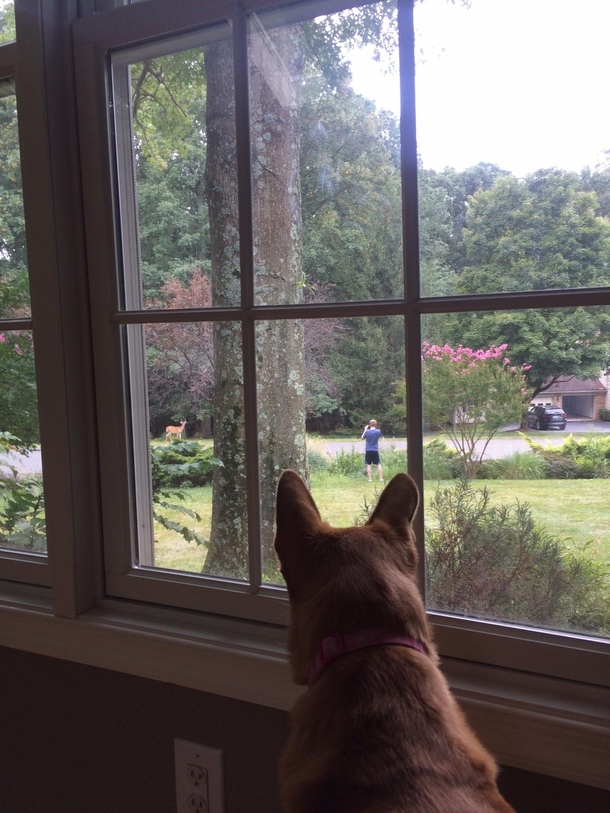
Find the location of a particular element. window pane is located at coordinates (501, 455), (314, 374), (185, 392), (184, 170), (331, 188), (496, 216), (13, 219), (20, 511), (5, 14), (130, 0).